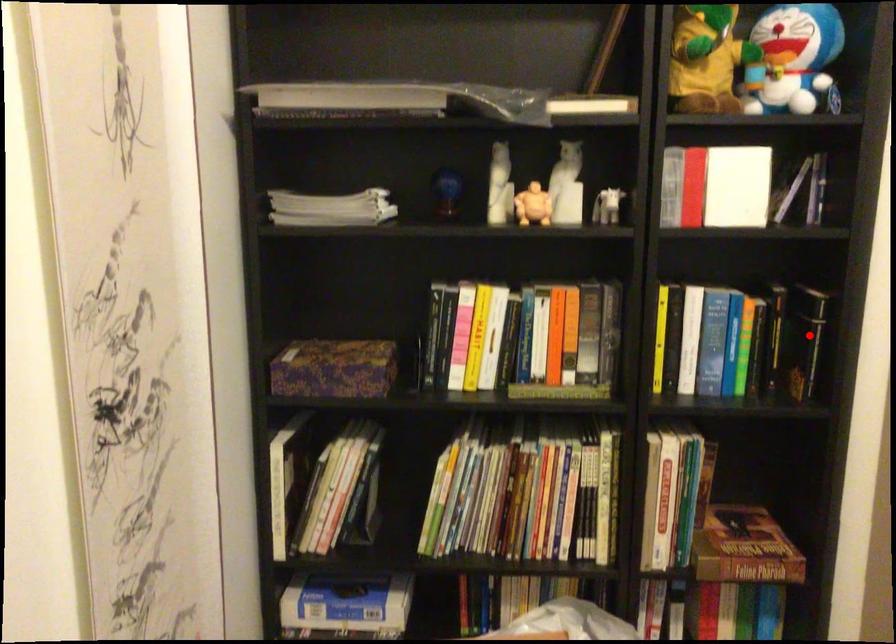
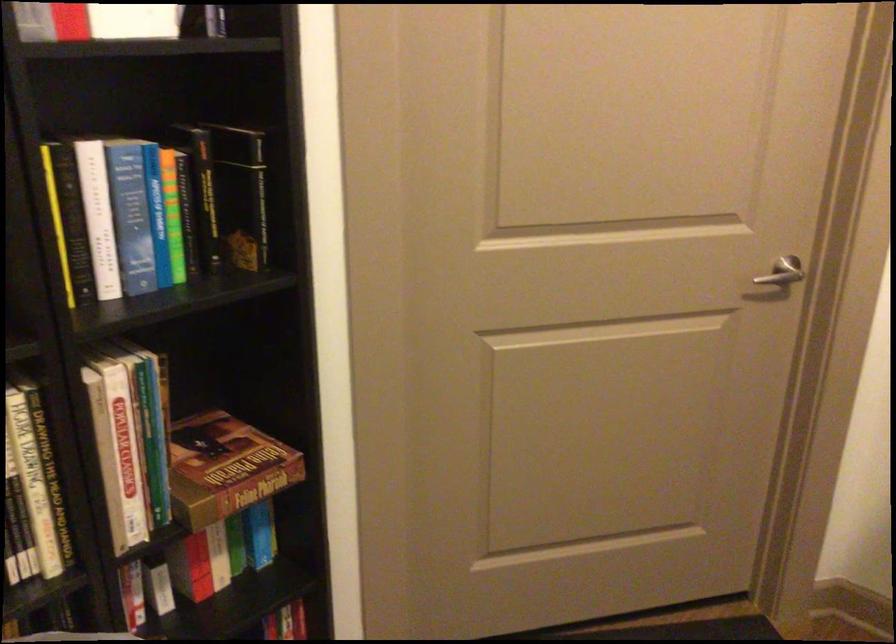
Where in the second image is the point corresponding to the highlighted location from the first image?

(240, 194)